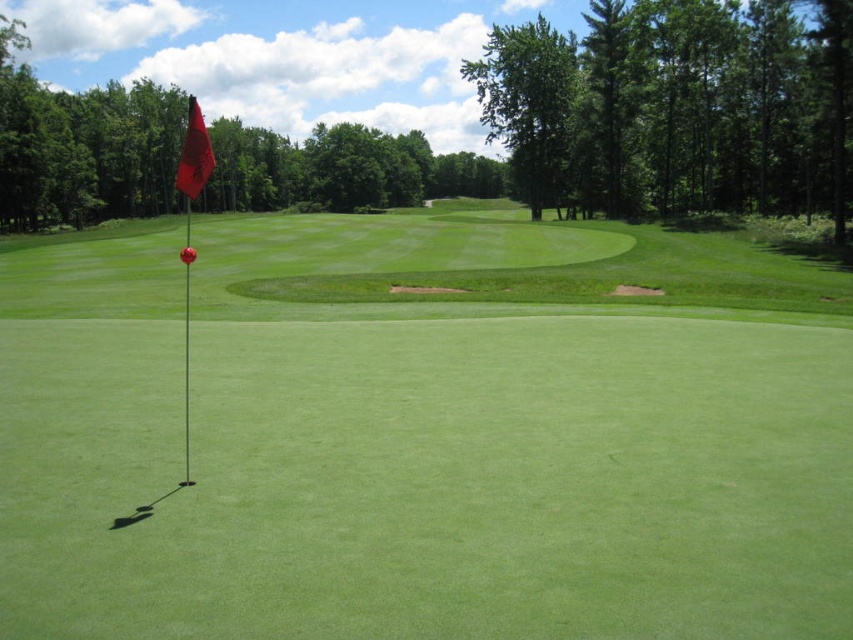
You are a golfer standing at the tee, looking at the putting green. You notice two points marked on the ground. The first point is at coordinate point (x=154, y=596) and the second is at point (x=202, y=172). Which point is closer to your current position?

The point at coordinate point (x=154, y=596) is closer to your current position because it is closer to the camera than point (x=202, y=172).

You are a golfer preparing to putt on the green. You notice two red flags in your line of sight. Which flag is closer to the ground, the red flag at center or the red fabric flag at upper left?

The red flag at center is shorter than the red fabric flag at upper left, so the red flag at center is closer to the ground.

You are a golfer standing at the red flag at center and want to hit the ball towards the red fabric flag at upper left. The golf course has a rule that requires you to stay at least 50 feet away from any flag to avoid disrupting play. Is your current position compliant with this rule?

The distance between the red flag at center and the red fabric flag at upper left is 46.76 feet. Since the required minimum distance is 50 feet, your current position is not compliant with the rule.